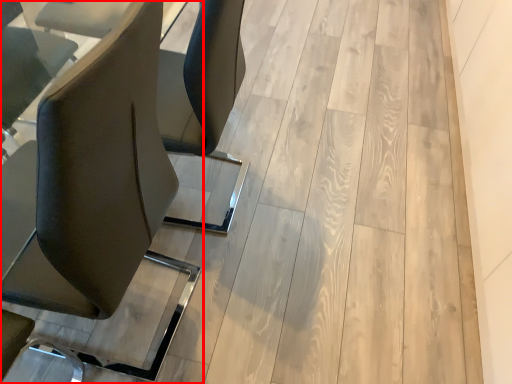
Question: From the image's perspective, what is the correct spatial positioning of chair (annotated by the red box) in reference to plywood?

Choices:
 (A) below
 (B) above

Answer: (A)